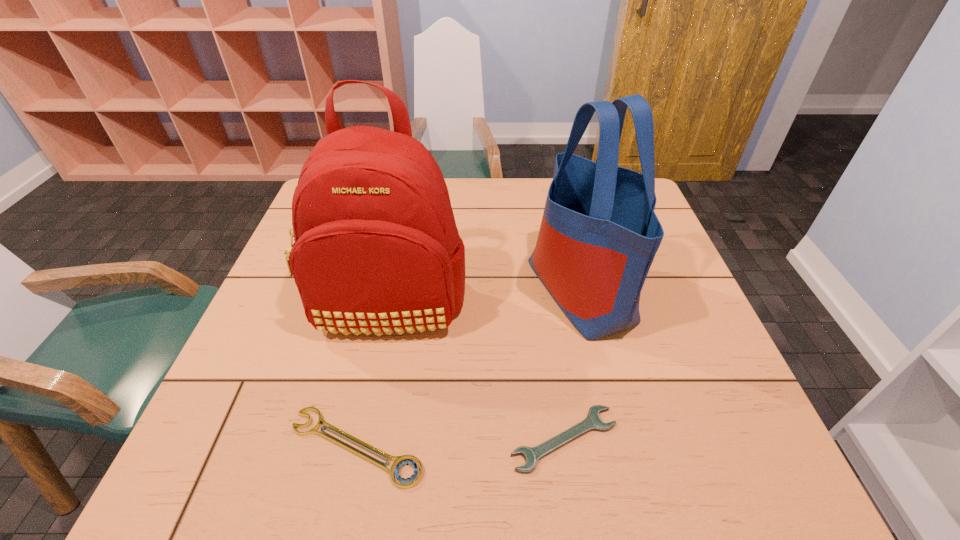
Image resolution: width=960 pixels, height=540 pixels. What are the coordinates of `vacant space that's between the backpack and the left wrench` in the screenshot? It's located at (372, 376).

Locate an element on the screen. This screenshot has height=540, width=960. object that is the second closest to the right wrench is located at coordinates (599, 234).

Locate which object is the second closest to the handbag. Please provide its 2D coordinates. Your answer should be formatted as a tuple, i.e. [(x, y)], where the tuple contains the x and y coordinates of a point satisfying the conditions above.

[(377, 249)]

Where is `vacant space that satisfies the following two spatial constraints: 1. on the front-facing side of the backpack; 2. on the right side of the right wrench`? The image size is (960, 540). vacant space that satisfies the following two spatial constraints: 1. on the front-facing side of the backpack; 2. on the right side of the right wrench is located at coordinates (361, 439).

Identify the location of free space that satisfies the following two spatial constraints: 1. on the front-facing side of the backpack; 2. on the left side of the right wrench. (x=361, y=439).